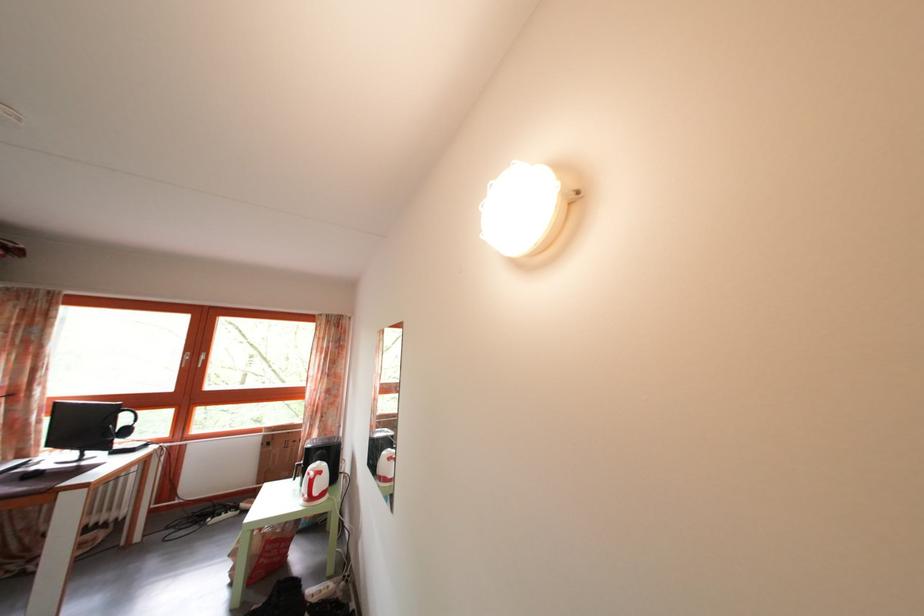
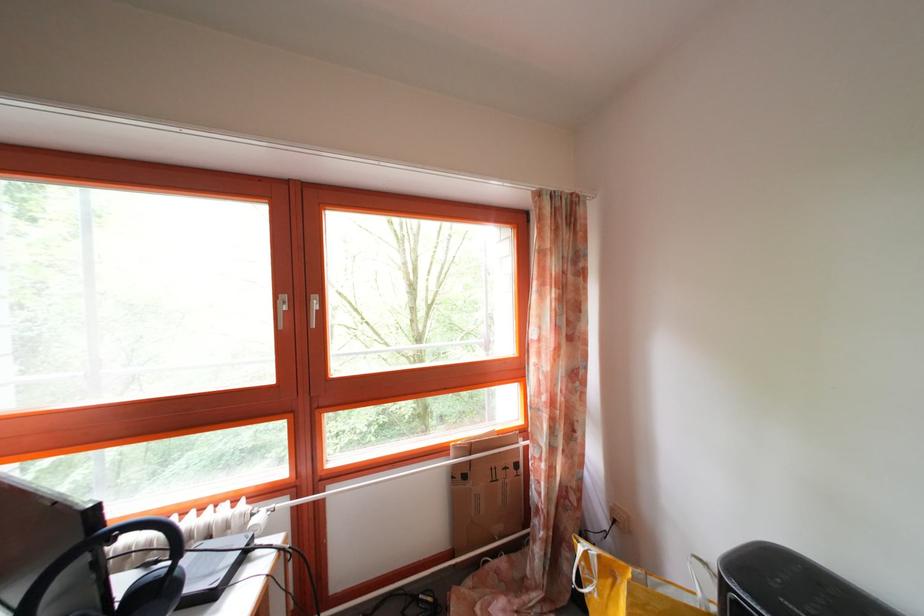
Locate, in the second image, the point that corresponds to the point at 275,451 in the first image.

(472, 484)